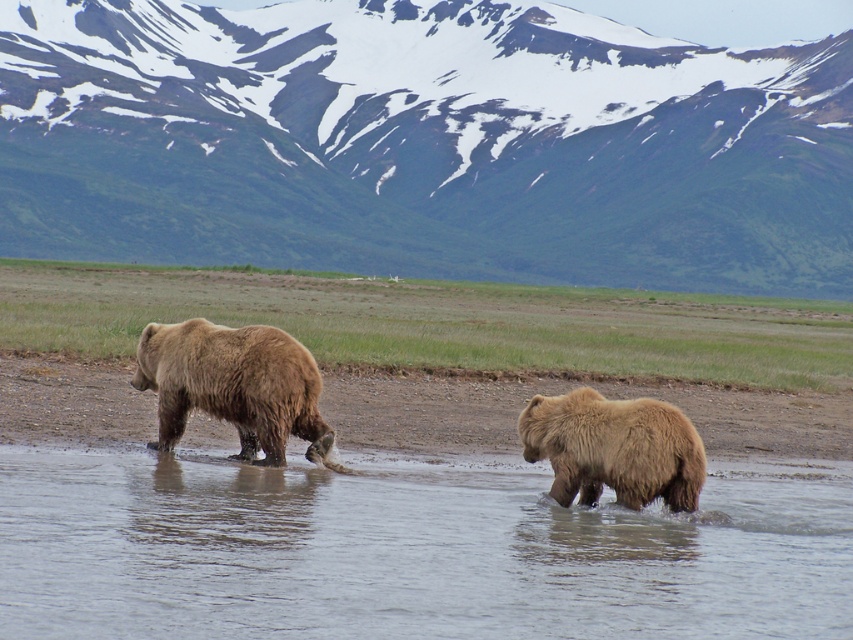
Does point (311, 237) come closer to viewer compared to point (194, 348)?

No, it is behind (194, 348).

Can you confirm if snowy rock mountain at upper center is wider than fuzzy brown bear at left?

Correct, the width of snowy rock mountain at upper center exceeds that of fuzzy brown bear at left.

Is point (744, 83) closer to viewer compared to point (225, 384)?

No, (744, 83) is behind (225, 384).

Find the location of `snowy rock mountain at upper center`. snowy rock mountain at upper center is located at coordinates (424, 144).

Based on the photo, does snowy rock mountain at upper center have a larger size compared to clear water at lower center?

Yes, snowy rock mountain at upper center is bigger than clear water at lower center.

Is snowy rock mountain at upper center above clear water at lower center?

Yes, snowy rock mountain at upper center is above clear water at lower center.

This screenshot has width=853, height=640. Identify the location of snowy rock mountain at upper center. (424, 144).

You are a GUI agent. You are given a task and a screenshot of the screen. Output one action in this format:
    pyautogui.click(x=<x>, y=<y>)
    Task: Click on the snowy rock mountain at upper center
    
    Given the screenshot: What is the action you would take?
    pyautogui.click(x=424, y=144)

What do you see at coordinates (410, 552) in the screenshot? I see `clear water at lower center` at bounding box center [410, 552].

Does point (68, 545) come in front of point (277, 384)?

Yes, it is.

Locate an element on the screen. clear water at lower center is located at coordinates 410,552.